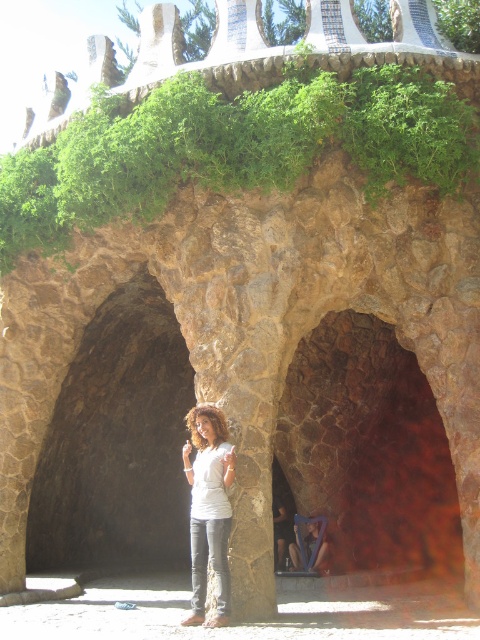
Question: Does rustic stone arch at center appear on the left side of white matte shirt at center?

Choices:
 (A) no
 (B) yes

Answer: (A)

Question: Which object appears farthest from the camera in this image?

Choices:
 (A) rustic stone arch at center
 (B) white matte shirt at center

Answer: (A)

Question: Can you confirm if rustic stone arch at center is positioned above white matte shirt at center?

Choices:
 (A) yes
 (B) no

Answer: (A)

Question: Which object is closer to the camera taking this photo?

Choices:
 (A) rustic stone arch at center
 (B) white matte shirt at center

Answer: (B)

Question: Is rustic stone arch at center closer to camera compared to white matte shirt at center?

Choices:
 (A) yes
 (B) no

Answer: (B)